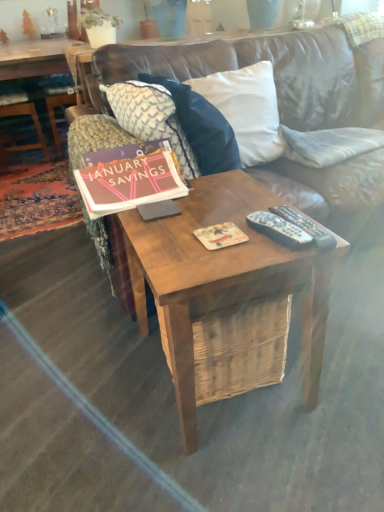
Question: From the image's perspective, is patterned fabric pillow at center, positioned as the third pillow in right-to-left order, located beneath woodenwoodencoffee table at left?

Choices:
 (A) no
 (B) yes

Answer: (B)

Question: Can you confirm if patterned fabric pillow at center, the first pillow in the left-to-right sequence, is taller than woodenwoodencoffee table at left?

Choices:
 (A) no
 (B) yes

Answer: (A)

Question: Is patterned fabric pillow at center, the first pillow in the left-to-right sequence, positioned with its back to woodenwoodencoffee table at left?

Choices:
 (A) yes
 (B) no

Answer: (B)

Question: Is patterned fabric pillow at center, positioned as the third pillow in right-to-left order, oriented towards woodenwoodencoffee table at left?

Choices:
 (A) yes
 (B) no

Answer: (B)

Question: From a real-world perspective, is patterned fabric pillow at center, positioned as the third pillow in right-to-left order, on top of woodenwoodencoffee table at left?

Choices:
 (A) yes
 (B) no

Answer: (A)

Question: Can you confirm if patterned fabric pillow at center, positioned as the third pillow in right-to-left order, is bigger than woodenwoodencoffee table at left?

Choices:
 (A) yes
 (B) no

Answer: (B)

Question: Can you confirm if matte cardboard magazine at center is bigger than patterned fabric pillow at center, positioned as the third pillow in right-to-left order?

Choices:
 (A) no
 (B) yes

Answer: (A)

Question: Is matte cardboard magazine at center wider than patterned fabric pillow at center, positioned as the third pillow in right-to-left order?

Choices:
 (A) no
 (B) yes

Answer: (A)

Question: Considering the relative sizes of matte cardboard magazine at center and patterned fabric pillow at center, positioned as the third pillow in right-to-left order, in the image provided, is matte cardboard magazine at center shorter than patterned fabric pillow at center, positioned as the third pillow in right-to-left order,?

Choices:
 (A) no
 (B) yes

Answer: (B)

Question: Is patterned fabric pillow at center, positioned as the third pillow in right-to-left order, at the back of matte cardboard magazine at center?

Choices:
 (A) yes
 (B) no

Answer: (A)

Question: Is matte cardboard magazine at center closer to the viewer compared to patterned fabric pillow at center, the first pillow in the left-to-right sequence?

Choices:
 (A) no
 (B) yes

Answer: (B)

Question: Can you confirm if matte cardboard magazine at center is smaller than patterned fabric pillow at center, the first pillow in the left-to-right sequence?

Choices:
 (A) yes
 (B) no

Answer: (A)

Question: From a real-world perspective, is white matte pot at upper left positioned under matte pink paper at center based on gravity?

Choices:
 (A) no
 (B) yes

Answer: (A)